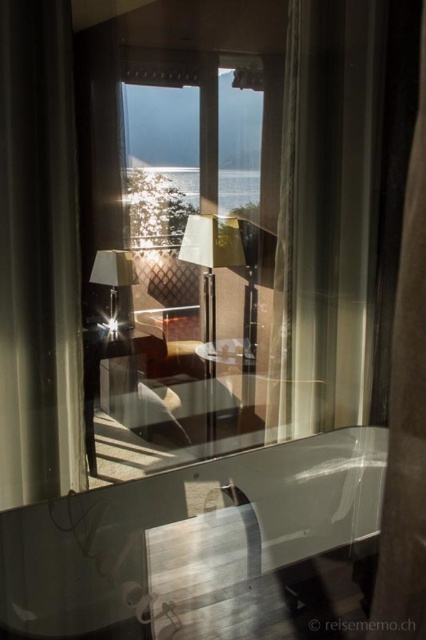
Does point (28, 154) come closer to viewer compared to point (282, 244)?

Yes, point (28, 154) is in front of point (282, 244).

The width and height of the screenshot is (426, 640). I want to click on satin beige curtain at left, so click(x=39, y=257).

Where is `satin beige curtain at left`? The image size is (426, 640). satin beige curtain at left is located at coordinates (39, 257).

Between point (92, 540) and point (215, 243), which one is positioned in front?

Point (92, 540) is in front.

Does transparent glass table at center have a larger size compared to matte gold lamp at center?

Yes, transparent glass table at center is bigger than matte gold lamp at center.

Where is `transparent glass table at center`? This screenshot has width=426, height=640. transparent glass table at center is located at coordinates (201, 547).

Does matte wooden table at center have a greater height compared to matte glass table at center?

Yes.

Who is positioned more to the left, matte wooden table at center or matte glass table at center?

Positioned to the left is matte wooden table at center.

Where is `matte wooden table at center`? matte wooden table at center is located at coordinates (109, 374).